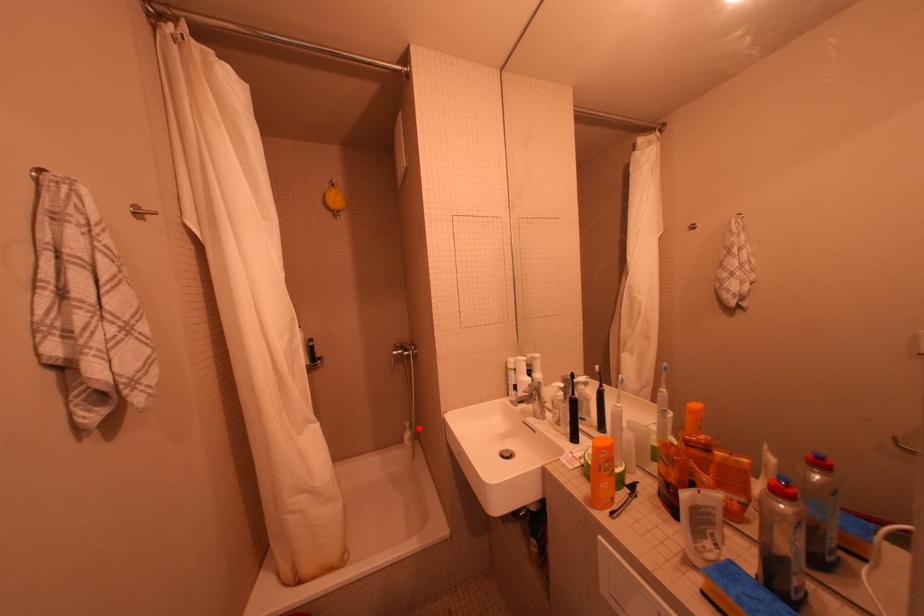
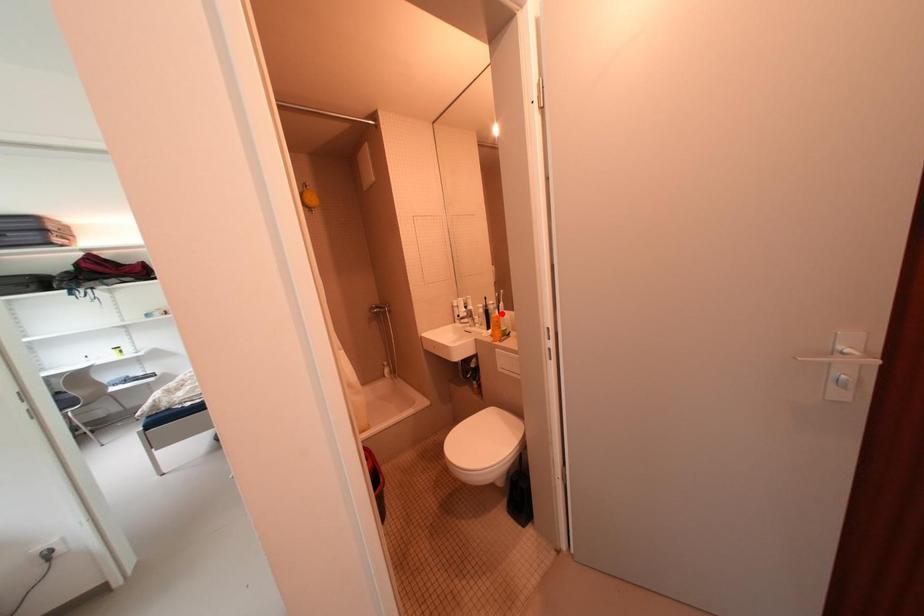
Looking at this image, I am providing you with two images of the same scene from different viewpoints. A red point is marked on the first image and another point is marked on the second image. Is the marked point in image1 the same physical position as the marked point in image2?

No